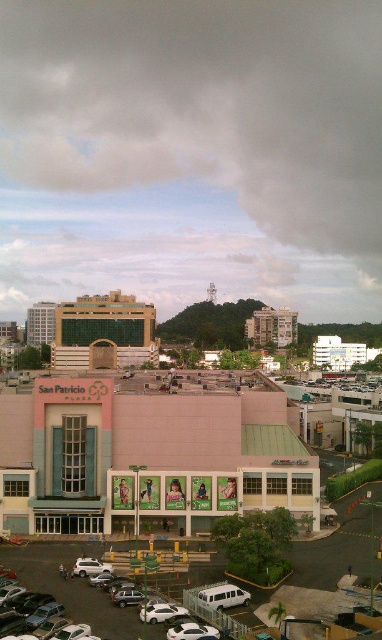
The height and width of the screenshot is (640, 382). Find the location of `green glass building at center`. green glass building at center is located at coordinates (103, 332).

Between green glass building at center and white matte building at upper center, which one appears on the left side from the viewer's perspective?

green glass building at center

Does point (121, 324) lie behind point (349, 353)?

No.

What are the coordinates of `green glass building at center` in the screenshot? It's located at (103, 332).

Between point (106, 465) and point (357, 358), which one is positioned behind?

The point (357, 358) is more distant.

Is point (160, 476) positioned in front of point (357, 352)?

Yes, point (160, 476) is in front of point (357, 352).

Where is `pink matte building at center`? The height and width of the screenshot is (640, 382). pink matte building at center is located at coordinates click(147, 456).

Is point (278, 336) positioned before point (27, 330)?

Yes, it is in front of point (27, 330).

Locate an element on the screen. white textured building at center-right is located at coordinates (271, 326).